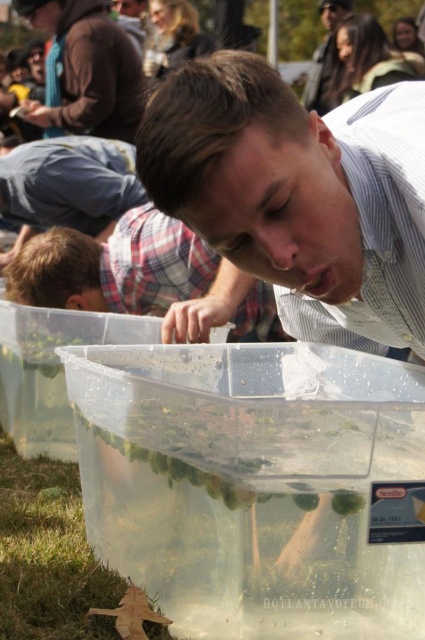
Who is taller, matte white shirt at center or green leafy vegetable at lower center?

With more height is matte white shirt at center.

Between matte white shirt at center and green leafy vegetable at lower center, which one is positioned higher?

matte white shirt at center is higher up.

This screenshot has height=640, width=425. I want to click on matte white shirt at center, so click(x=299, y=195).

Identify the location of matte blue shirt at center. Image resolution: width=425 pixels, height=640 pixels. 144,278.

Between matte blue shirt at center and plaid fabric shirt at center, which one is positioned higher?

plaid fabric shirt at center is above.

Between point (61, 280) and point (39, 193), which one is positioned behind?

The point (39, 193) is more distant.

The height and width of the screenshot is (640, 425). Identify the location of matte blue shirt at center. (144, 278).

Measure the distance from matte blue shirt at center to green leafy vegetable at lower center.

They are 5.08 feet apart.

In the scene shown: Is matte blue shirt at center smaller than green leafy vegetable at lower center?

No, matte blue shirt at center is not smaller than green leafy vegetable at lower center.

Which is in front, point (263, 332) or point (345, 499)?

Point (345, 499) is in front.

This screenshot has height=640, width=425. Find the location of `matte blue shirt at center`. matte blue shirt at center is located at coordinates (144, 278).